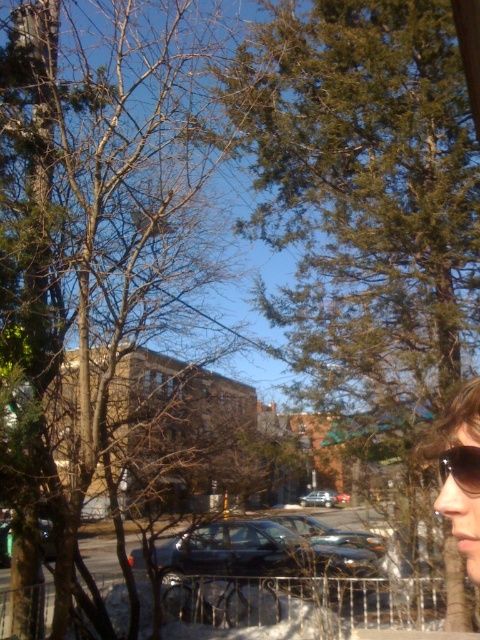
Question: Is green leafy tree at upper right to the left of sunglasses at right from the viewer's perspective?

Choices:
 (A) yes
 (B) no

Answer: (A)

Question: Is green leafy tree at upper right above black plastic goggles at right?

Choices:
 (A) yes
 (B) no

Answer: (A)

Question: Can you confirm if green leafy tree at upper right is smaller than metallic gray sedan at center?

Choices:
 (A) yes
 (B) no

Answer: (B)

Question: Estimate the real-world distances between objects in this image. Which object is farther from the black plastic goggles at right?

Choices:
 (A) sunglasses at right
 (B) metallic silver sedan at center

Answer: (B)

Question: Which object appears farthest from the camera in this image?

Choices:
 (A) black plastic goggles at right
 (B) green leafy tree at upper right
 (C) metallic silver sedan at center
 (D) bare branches at center

Answer: (C)

Question: Which of the following is the farthest from the observer?

Choices:
 (A) (403, 42)
 (B) (440, 465)
 (C) (9, 554)
 (D) (220, 540)

Answer: (C)